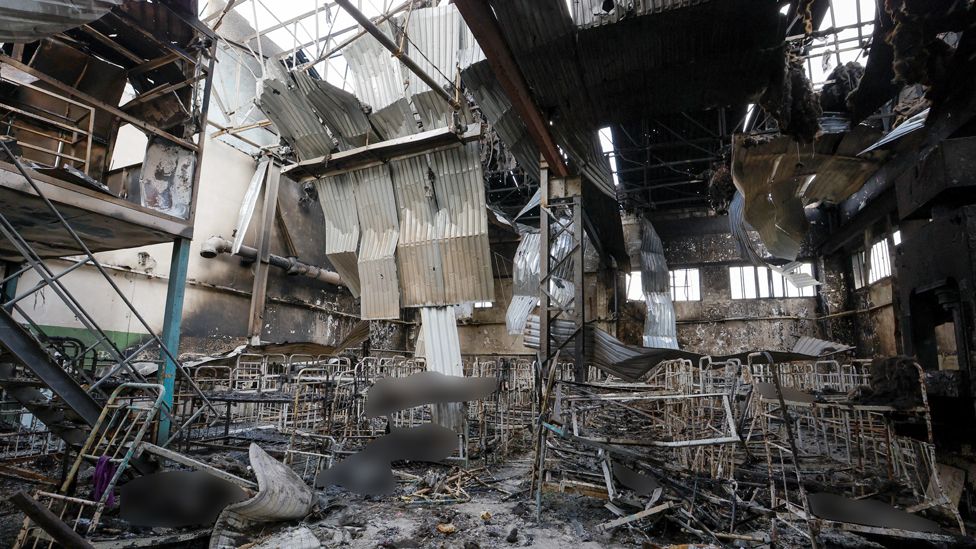
You are a GUI agent. You are given a task and a screenshot of the screen. Output one action in this format:
    pyautogui.click(x=<x>, y=<y>)
    Task: Click on the brick wall
    Image resolution: width=976 pixels, height=549 pixels.
    Given the screenshot: What is the action you would take?
    pyautogui.click(x=735, y=337), pyautogui.click(x=494, y=336)